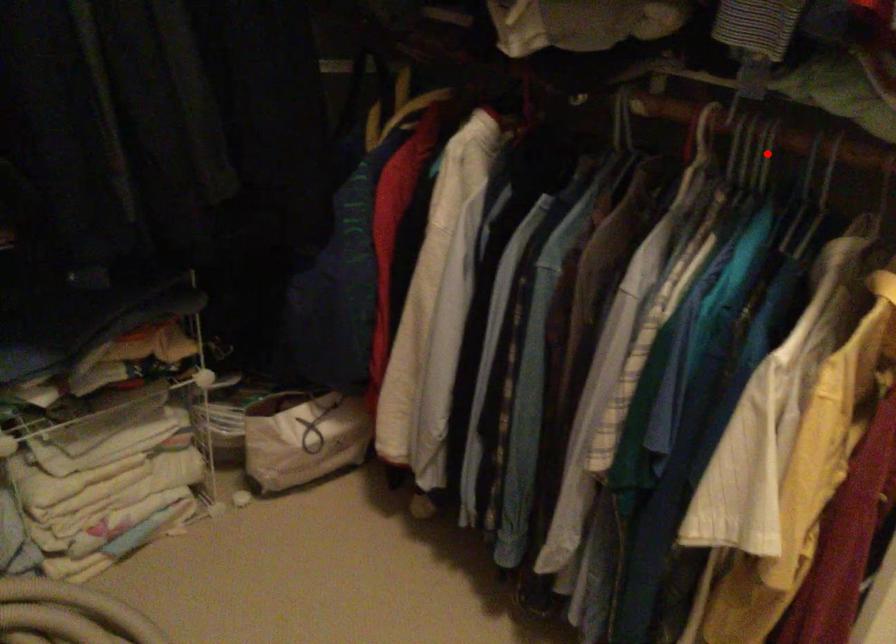
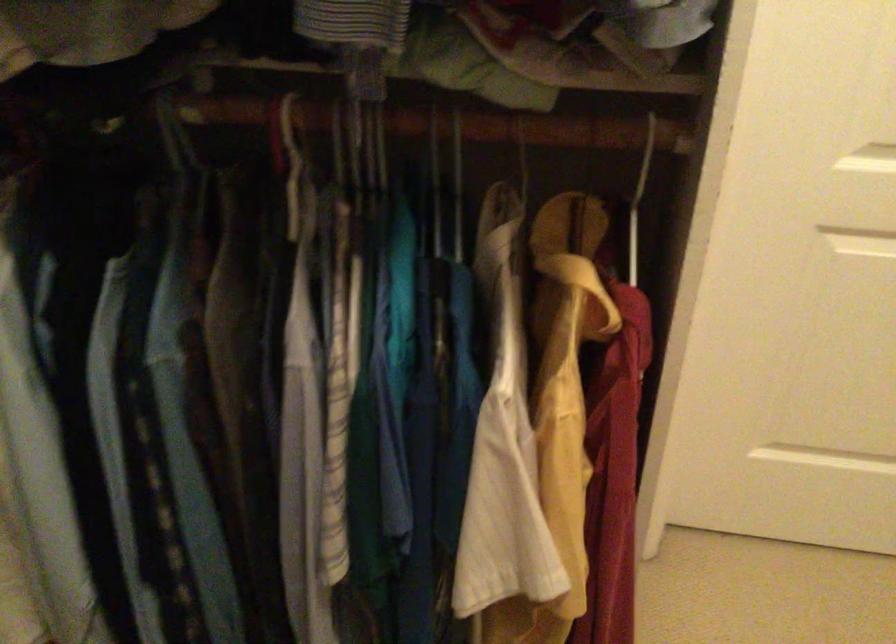
Locate, in the second image, the point that corresponds to the highlighted location in the first image.

(383, 144)